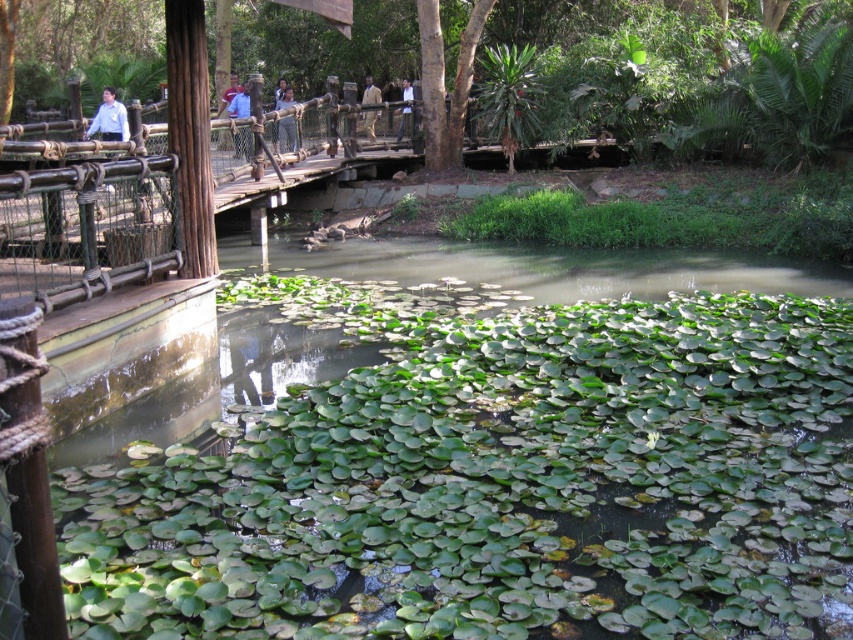
Question: Estimate the real-world distances between objects in this image. Which object is farther from the light brown wooden fence at center?

Choices:
 (A) white shirt at upper left
 (B) light blue shirt at center

Answer: (A)

Question: Which point is closer to the camera?

Choices:
 (A) light brown leather jacket at center
 (B) blue fabric shirt at upper center
 (C) white shirt at upper center

Answer: (B)

Question: In this image, where is blue fabric shirt at upper center located relative to light brown wooden fence at center?

Choices:
 (A) right
 (B) left

Answer: (B)

Question: Is light brown leather jacket at center smaller than blue fabric shirt at upper center?

Choices:
 (A) no
 (B) yes

Answer: (B)

Question: Which point is farther to the camera?

Choices:
 (A) (286, 116)
 (B) (279, 93)

Answer: (B)

Question: Is white shirt at upper left thinner than blue shirt at center?

Choices:
 (A) no
 (B) yes

Answer: (B)